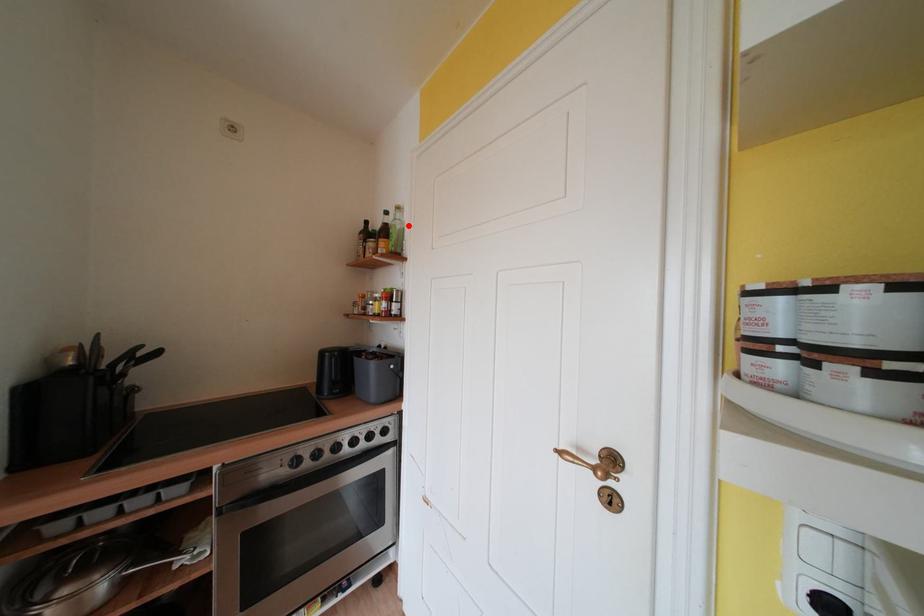
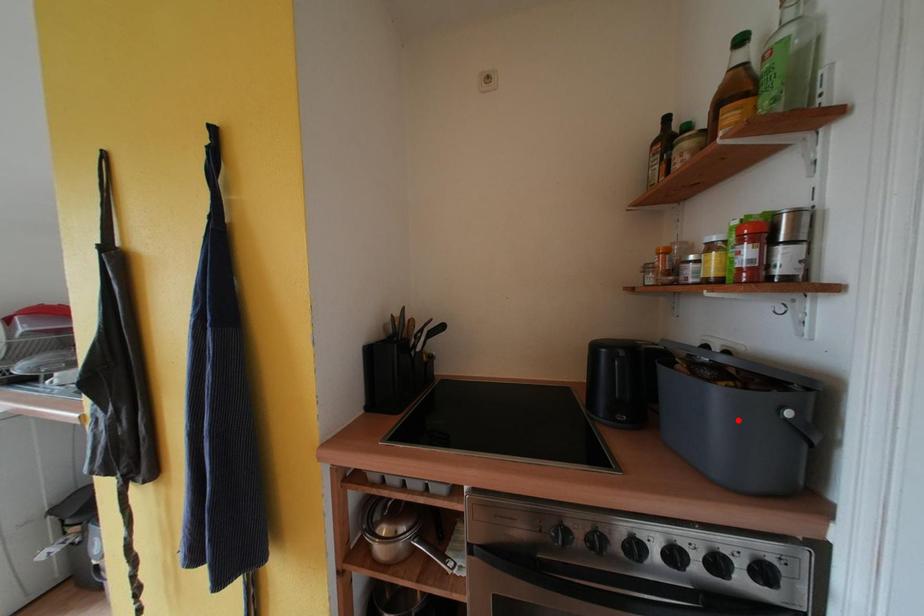
I am providing you with two images of the same scene from different viewpoints. A red point is marked on the first image and another point is marked on the second image. Are the points marked in image1 and image2 representing the same 3D position?

No